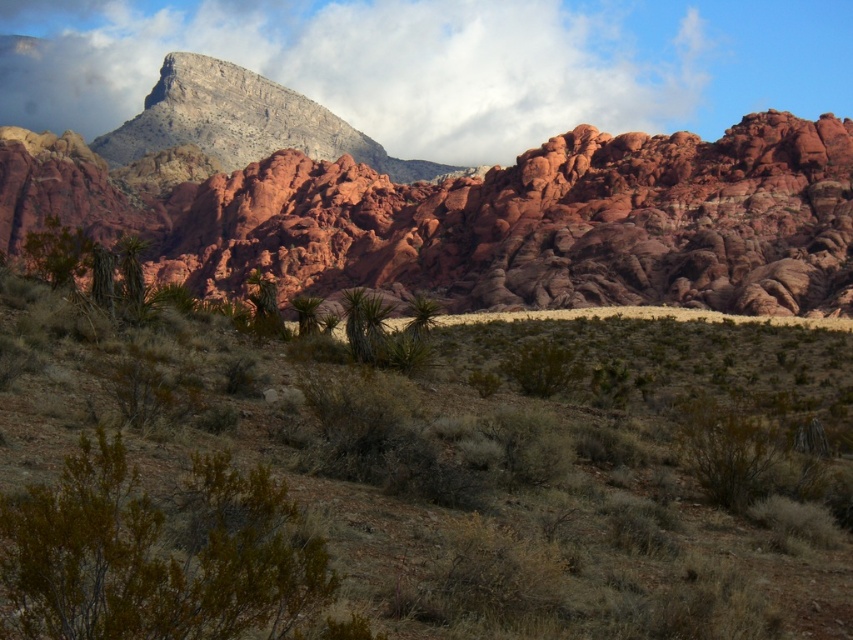
Question: Observing the image, what is the correct spatial positioning of brown shrubbery at center in reference to green leafy bush at lower left?

Choices:
 (A) right
 (B) left

Answer: (A)

Question: Can you confirm if brown shrubbery at center is thinner than reddish rock formation at upper center?

Choices:
 (A) no
 (B) yes

Answer: (B)

Question: Is brown shrubbery at center positioned at the back of green leafy bush at lower left?

Choices:
 (A) yes
 (B) no

Answer: (A)

Question: Which point is closer to the camera taking this photo?

Choices:
 (A) (289, 508)
 (B) (582, 77)
 (C) (303, 586)
 (D) (345, 228)

Answer: (C)

Question: Which point is farther to the camera?

Choices:
 (A) reddish rock formation at upper center
 (B) brown shrubbery at center
 (C) green leafy bush at lower left
 (D) cloudy sky at upper center

Answer: (D)

Question: Estimate the real-world distances between objects in this image. Which object is farther from the cloudy sky at upper center?

Choices:
 (A) reddish rock formation at upper center
 (B) green leafy bush at lower left
 (C) brown shrubbery at center

Answer: (B)